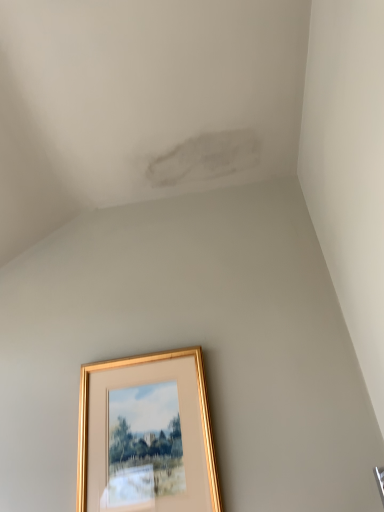
Measure the distance between gold-framed picture at center and camera.

The depth of gold-framed picture at center is 36.10 inches.

Describe the element at coordinates (146, 436) in the screenshot. I see `gold-framed picture at center` at that location.

Find the location of a particular element. This screenshot has height=512, width=384. gold-framed picture at center is located at coordinates 146,436.

Locate an element on the screen. The height and width of the screenshot is (512, 384). gold-framed picture at center is located at coordinates 146,436.